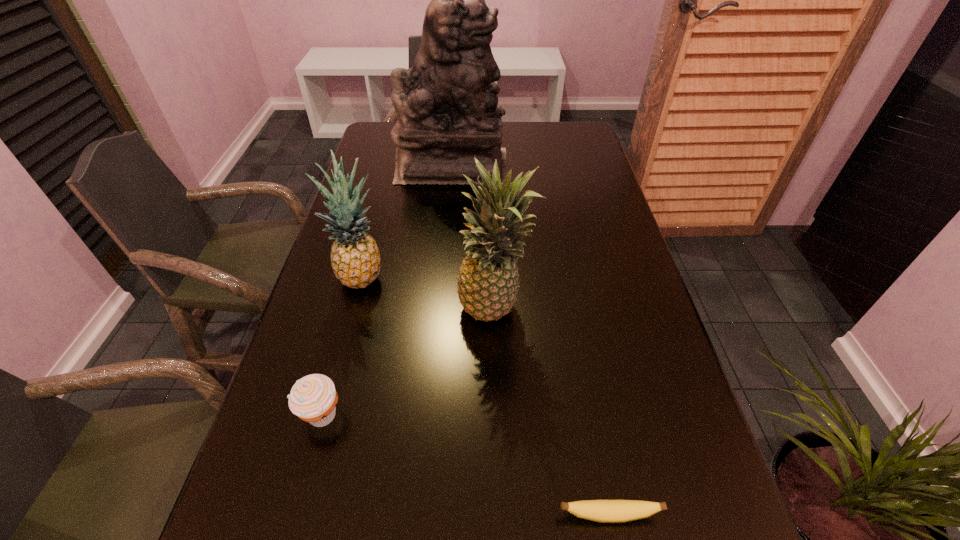
You are a GUI agent. You are given a task and a screenshot of the screen. Output one action in this format:
    pyautogui.click(x=<x>, y=<y>)
    Task: Click on the unoccupied area between the banana and the fourth tallest object
    The height and width of the screenshot is (540, 960).
    Given the screenshot: What is the action you would take?
    pyautogui.click(x=465, y=465)

At what (x,y) coordinates should I click in order to perform the action: click on empty location between the left pineapple and the sculpture. Please return your answer as a coordinate pair (x, y). Looking at the image, I should click on (407, 221).

This screenshot has width=960, height=540. In order to click on vacant space in between the left pineapple and the second shortest object in this screenshot , I will do `click(342, 346)`.

Locate which object ranks third in proximity to the left pineapple. Please provide its 2D coordinates. Your answer should be formatted as a tuple, i.e. [(x, y)], where the tuple contains the x and y coordinates of a point satisfying the conditions above.

[(447, 110)]

This screenshot has width=960, height=540. Find the location of `object that can be found as the third closest to the shortest object`. object that can be found as the third closest to the shortest object is located at coordinates (355, 258).

Where is `free space that satisfies the following two spatial constraints: 1. on the front side of the shortest object; 2. on the left side of the muffin`? free space that satisfies the following two spatial constraints: 1. on the front side of the shortest object; 2. on the left side of the muffin is located at coordinates (294, 515).

Find the location of a particular element. Image resolution: width=960 pixels, height=540 pixels. blank area in the image that satisfies the following two spatial constraints: 1. on the back side of the right pineapple; 2. on the front-facing side of the farthest object is located at coordinates (490, 165).

The width and height of the screenshot is (960, 540). I want to click on vacant area in the image that satisfies the following two spatial constraints: 1. on the front side of the right pineapple; 2. on the right side of the shortest object, so click(500, 515).

Find the location of a particular element. This screenshot has width=960, height=540. vacant position in the image that satisfies the following two spatial constraints: 1. on the front-facing side of the right pineapple; 2. on the right side of the tallest object is located at coordinates (440, 311).

I want to click on vacant space that satisfies the following two spatial constraints: 1. on the front-facing side of the sculpture; 2. on the left side of the nearest object, so click(422, 515).